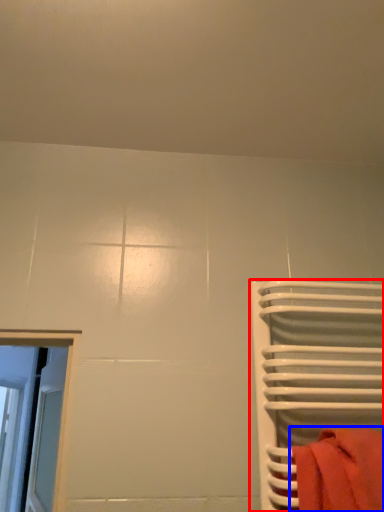
Question: Which object appears closest to the camera in this image, furniture (highlighted by a red box) or towel (highlighted by a blue box)?

Choices:
 (A) furniture
 (B) towel

Answer: (B)